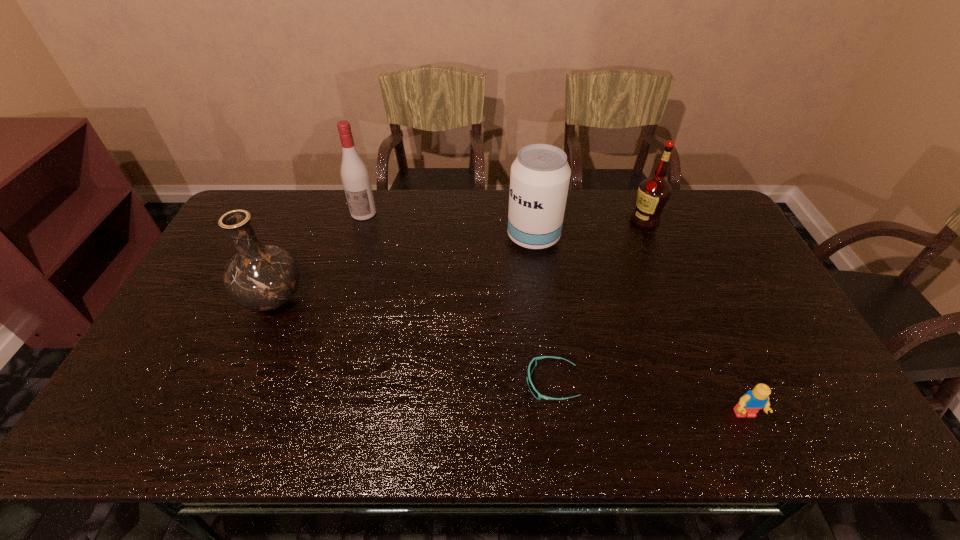
This screenshot has width=960, height=540. I want to click on free spot between the second nearest object and the fifth tallest object, so click(x=648, y=399).

Locate an element on the screen. The image size is (960, 540). free space between the third nearest object and the rightmost alcohol is located at coordinates (459, 260).

The height and width of the screenshot is (540, 960). I want to click on empty space between the rightmost alcohol and the vase, so click(459, 260).

Locate an element on the screen. The width and height of the screenshot is (960, 540). vacant area that lies between the fifth tallest object and the sunglasses is located at coordinates (648, 399).

In order to click on vacant point located between the fifth farthest object and the rightmost alcohol in this screenshot , I will do `click(598, 302)`.

The height and width of the screenshot is (540, 960). I want to click on object that is the fifth closest to the Lego, so click(355, 177).

Locate which object is the closest to the rightmost alcohol. Please provide its 2D coordinates. Your answer should be formatted as a tuple, i.e. [(x, y)], where the tuple contains the x and y coordinates of a point satisfying the conditions above.

[(540, 175)]

Where is `alcohol that is the closest to the fifth farthest object`? The image size is (960, 540). alcohol that is the closest to the fifth farthest object is located at coordinates (540, 175).

Where is `alcohol that is the nearest to the rightmost alcohol`? The height and width of the screenshot is (540, 960). alcohol that is the nearest to the rightmost alcohol is located at coordinates (540, 175).

Locate an element on the screen. The width and height of the screenshot is (960, 540). vacant space that satisfies the following two spatial constraints: 1. on the label of the leftmost alcohol; 2. on the left side of the second alcohol from right to left is located at coordinates (356, 237).